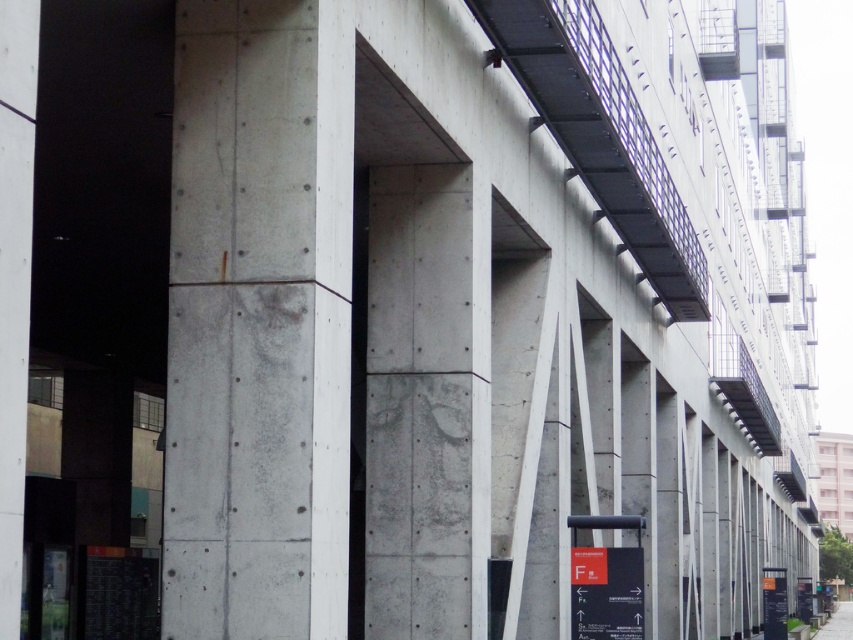
Which is behind, point (346, 448) or point (564, 77)?

Point (564, 77)

The height and width of the screenshot is (640, 853). What do you see at coordinates (259, 321) in the screenshot?
I see `gray concrete pillar at center` at bounding box center [259, 321].

The image size is (853, 640). I want to click on gray concrete pillar at center, so click(259, 321).

Who is positioned more to the left, gray concrete pillar at center or gray concrete pavement at lower right?

Positioned to the left is gray concrete pillar at center.

Is gray concrete pillar at center taller than gray concrete pavement at lower right?

No.

Where is `gray concrete pillar at center`? The image size is (853, 640). gray concrete pillar at center is located at coordinates (259, 321).

Is smooth black metal overpass at upper center positioned behind gray concrete pavement at lower right?

No, it is in front of gray concrete pavement at lower right.

Is the position of smooth black metal overpass at upper center less distant than that of gray concrete pavement at lower right?

Yes, smooth black metal overpass at upper center is in front of gray concrete pavement at lower right.

Is point (566, 96) closer to viewer compared to point (828, 628)?

Yes, point (566, 96) is closer to viewer.

This screenshot has height=640, width=853. I want to click on smooth black metal overpass at upper center, so click(601, 134).